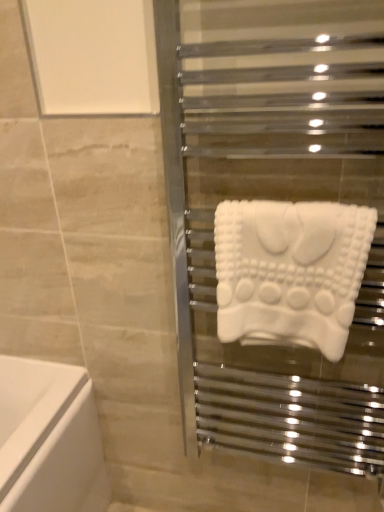
What do you see at coordinates (290, 271) in the screenshot? I see `white textured towel at center` at bounding box center [290, 271].

Locate an element on the screen. white textured towel at center is located at coordinates (290, 271).

You are a GUI agent. You are given a task and a screenshot of the screen. Output one action in this format:
    pyautogui.click(x=<x>, y=<y>)
    Task: Click on the white textured towel at center
    The height and width of the screenshot is (512, 384).
    Given the screenshot: What is the action you would take?
    pyautogui.click(x=290, y=271)